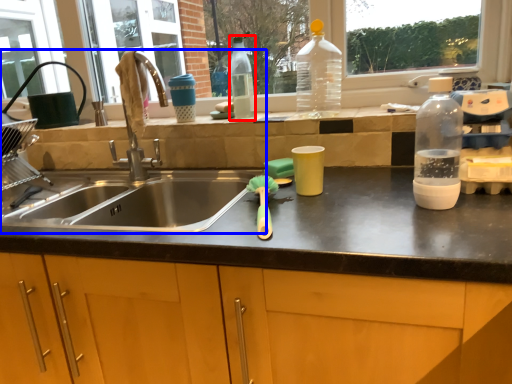
Question: Which object is further to the camera taking this photo, bottle (highlighted by a red box) or sink (highlighted by a blue box)?

Choices:
 (A) bottle
 (B) sink

Answer: (A)